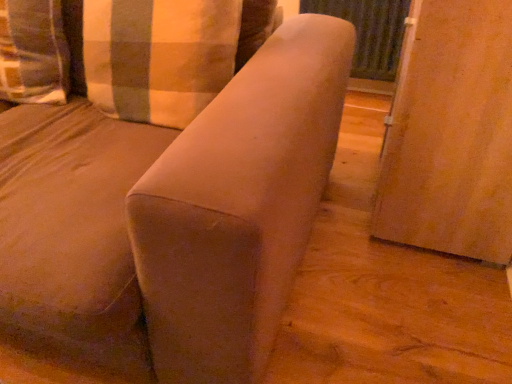
Question: Is plaid fabric pillow at upper left, the first pillow viewed from the right, positioned behind suede-like beige sofa at center?

Choices:
 (A) no
 (B) yes

Answer: (B)

Question: Is plaid fabric pillow at upper left, the first pillow viewed from the right, facing away from suede-like beige sofa at center?

Choices:
 (A) yes
 (B) no

Answer: (A)

Question: Is plaid fabric pillow at upper left, the second pillow in the left-to-right sequence, wider than suede-like beige sofa at center?

Choices:
 (A) yes
 (B) no

Answer: (B)

Question: Can you confirm if plaid fabric pillow at upper left, the second pillow in the left-to-right sequence, is thinner than suede-like beige sofa at center?

Choices:
 (A) no
 (B) yes

Answer: (B)

Question: Is plaid fabric pillow at upper left, the first pillow viewed from the right, at the left side of suede-like beige sofa at center?

Choices:
 (A) yes
 (B) no

Answer: (B)

Question: Is wooden screen door at right, which is counted as the 2th screen door, starting from the back, in front of plaid fabric pillow at upper left, the second pillow in the left-to-right sequence?

Choices:
 (A) yes
 (B) no

Answer: (A)

Question: Does wooden screen door at right, which is counted as the 1th screen door, starting from the front, touch plaid fabric pillow at upper left, the second pillow in the left-to-right sequence?

Choices:
 (A) no
 (B) yes

Answer: (A)

Question: Is wooden screen door at right, which is counted as the 2th screen door, starting from the back, oriented towards plaid fabric pillow at upper left, the second pillow in the left-to-right sequence?

Choices:
 (A) no
 (B) yes

Answer: (B)

Question: Is the depth of wooden screen door at right, which is counted as the 1th screen door, starting from the front, greater than that of plaid fabric pillow at upper left, the second pillow in the left-to-right sequence?

Choices:
 (A) yes
 (B) no

Answer: (B)

Question: Can you confirm if wooden screen door at right, which is counted as the 2th screen door, starting from the back, is bigger than plaid fabric pillow at upper left, the second pillow in the left-to-right sequence?

Choices:
 (A) no
 (B) yes

Answer: (B)

Question: Does wooden screen door at right, which is counted as the 1th screen door, starting from the front, have a lesser width compared to plaid fabric pillow at upper left, the first pillow viewed from the right?

Choices:
 (A) no
 (B) yes

Answer: (A)

Question: Does wooden screen door at right, which is counted as the 2th screen door, starting from the back, appear on the right side of suede-like beige sofa at center?

Choices:
 (A) yes
 (B) no

Answer: (A)